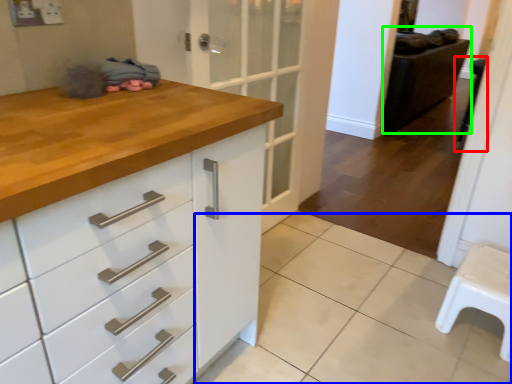
Question: Considering the real-world distances, which object is closest to step stool (highlighted by a red box)? tile (highlighted by a blue box) or chair (highlighted by a green box).

Choices:
 (A) tile
 (B) chair

Answer: (A)